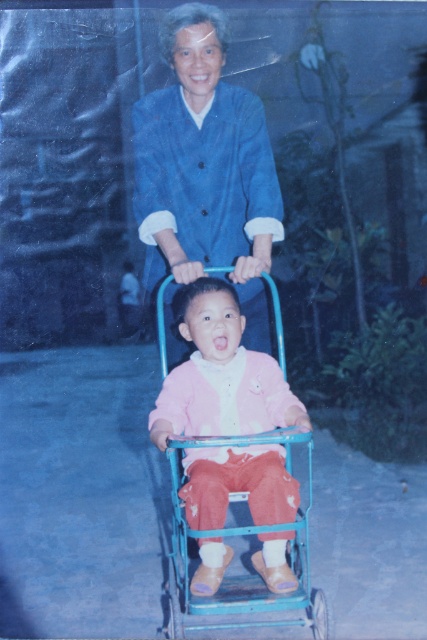
Which is behind, point (242, 234) or point (237, 358)?

Point (242, 234)

Which of these two, blue cotton jacket at upper center or pink fleece jacket at center, stands shorter?

pink fleece jacket at center

Measure the distance between blue cotton jacket at upper center and camera.

blue cotton jacket at upper center and camera are 3.51 meters apart.

Identify the location of blue cotton jacket at upper center. (205, 168).